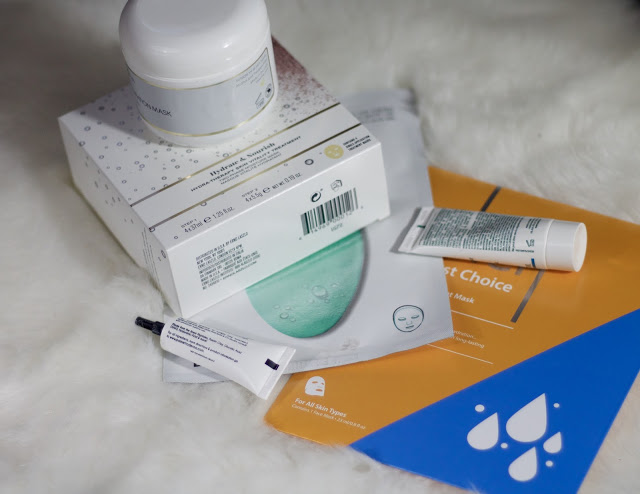
Locate an element on the screen. Image resolution: width=640 pixels, height=494 pixels. lotion jar is located at coordinates (191, 63).